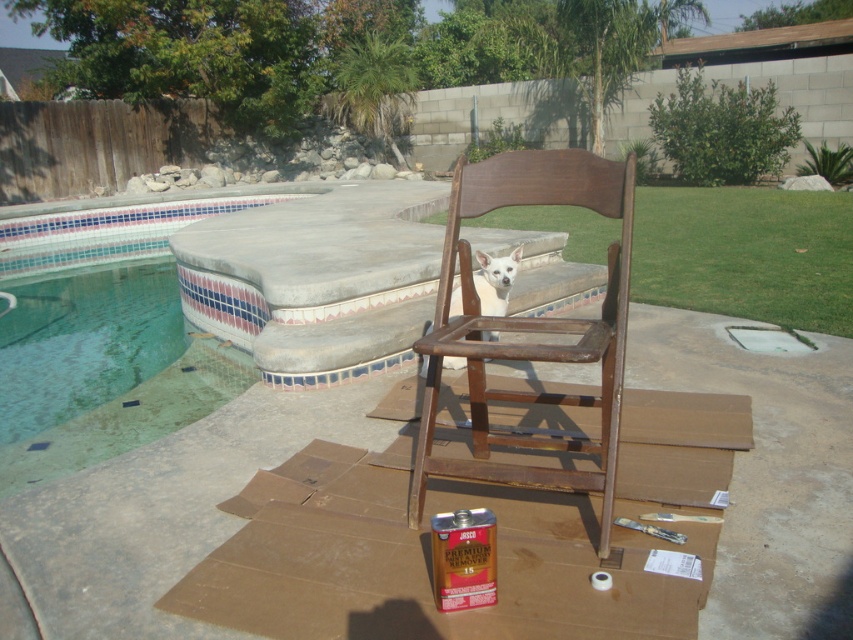
Who is positioned more to the right, green tile swimming pool at upper left or white smooth dog at center?

Positioned to the right is white smooth dog at center.

Does green tile swimming pool at upper left have a greater width compared to white smooth dog at center?

Yes, green tile swimming pool at upper left is wider than white smooth dog at center.

Describe the element at coordinates (103, 336) in the screenshot. I see `green tile swimming pool at upper left` at that location.

You are a GUI agent. You are given a task and a screenshot of the screen. Output one action in this format:
    pyautogui.click(x=<x>, y=<y>)
    Task: Click on the green tile swimming pool at upper left
    
    Given the screenshot: What is the action you would take?
    pyautogui.click(x=103, y=336)

Is point (175, 388) positioned in front of point (621, 289)?

That is False.

Which is below, green tile swimming pool at upper left or rustic wood chair at center?

rustic wood chair at center is below.

Which is behind, point (173, 292) or point (614, 458)?

Positioned behind is point (173, 292).

Find the location of `green tile swimming pool at upper left`. green tile swimming pool at upper left is located at coordinates (103, 336).

Between point (628, 163) and point (473, 284), which one is positioned in front?

Point (628, 163) is more forward.

Can you confirm if rustic wood chair at center is bigger than white smooth dog at center?

Indeed, rustic wood chair at center has a larger size compared to white smooth dog at center.

Who is more forward, (627, 244) or (474, 289)?

Point (627, 244)

You are a GUI agent. You are given a task and a screenshot of the screen. Output one action in this format:
    pyautogui.click(x=<x>, y=<y>)
    Task: Click on the rustic wood chair at center
    
    Given the screenshot: What is the action you would take?
    pos(531,324)